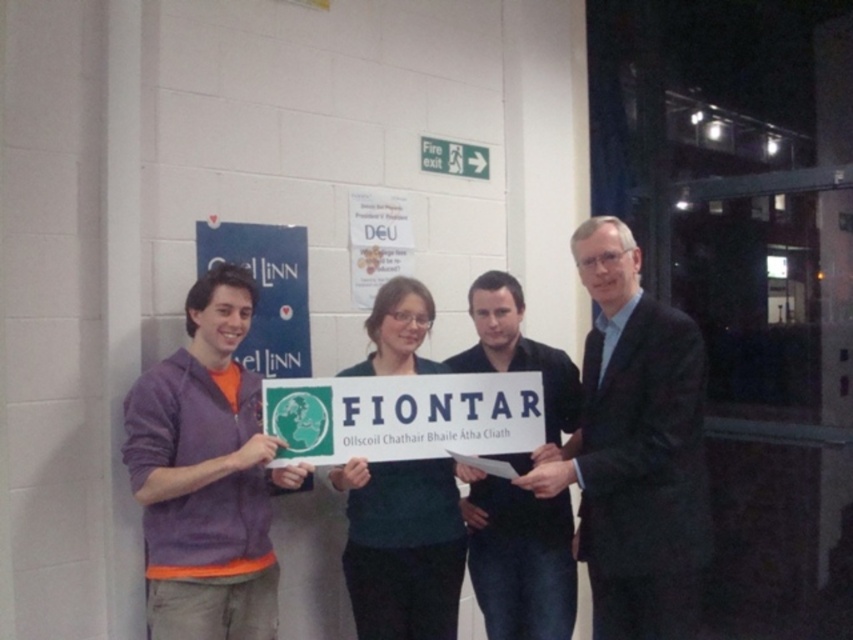
You are organizing a photo shoot and need to ensure that the dark suit at center and the dark blue shirt at center are visible in the frame. Based on their sizes, which one is more likely to be fully visible in the photo?

The dark suit at center is bigger than the dark blue shirt at center, so it is more likely to be fully visible in the photo.

You are a photographer trying to frame a group photo. You have to decide if the purple sweater at left and dark blue shirt at center can be centered in the frame without overlapping. Given that the camera can only capture objects within a 1.2 meter width, can both fit side by side?

The purple sweater at left is wider than the dark blue shirt at center. However, since the camera can capture up to 1.2 meters, both can fit side by side as long as their combined widths are under 1.2 meters. The exact widths are needed to confirm.

You are organizing a photo shoot and need to ensure that the dark suit at center and the purple sweater at left are visible in the frame. Based on their widths, which clothing item requires more horizontal space to fully capture in the photo?

The purple sweater at left requires more horizontal space because its width is greater than the dark suit at center.